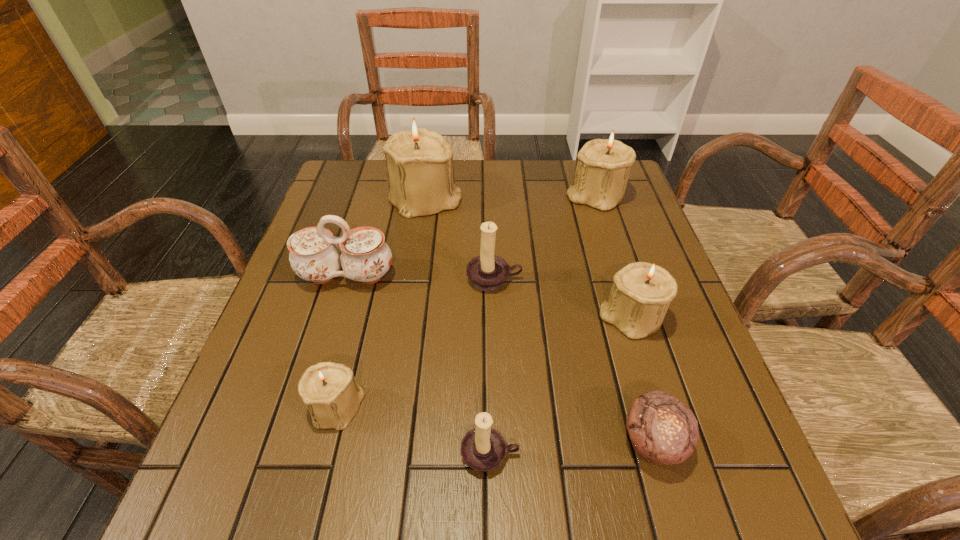
Image resolution: width=960 pixels, height=540 pixels. I want to click on the biggest beige candle_holder, so click(x=419, y=162).

Locate an element on the screen. the tallest object is located at coordinates (419, 162).

Find the location of a particular element. the fifth shortest candle holder is located at coordinates (603, 166).

Where is `the second biggest beige candle_holder`? This screenshot has height=540, width=960. the second biggest beige candle_holder is located at coordinates (603, 166).

Locate an element on the screen. The height and width of the screenshot is (540, 960). chinaware is located at coordinates (314, 256).

Find the location of a particular element. This screenshot has width=960, height=540. the fourth nearest object is located at coordinates (641, 292).

I want to click on the third biggest beige candle_holder, so click(x=641, y=292).

Image resolution: width=960 pixels, height=540 pixels. Identify the location of the third farthest candle holder. (488, 272).

At what (x,y) coordinates should I click in order to perform the action: click on the bigger brown candle holder. Please return your answer as a coordinate pair (x, y). Looking at the image, I should click on (488, 272).

Find the location of a particular element. The height and width of the screenshot is (540, 960). the smallest beige candle_holder is located at coordinates (332, 395).